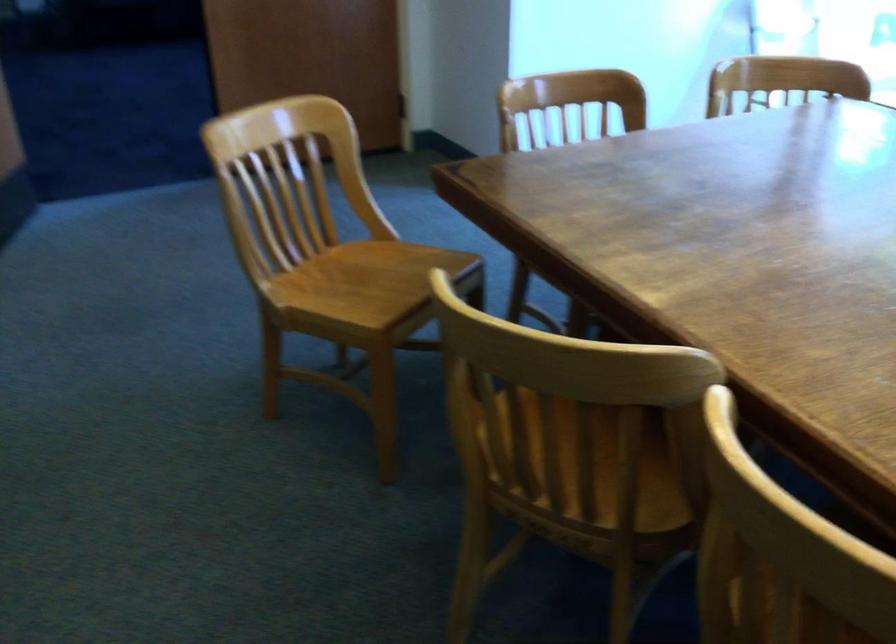
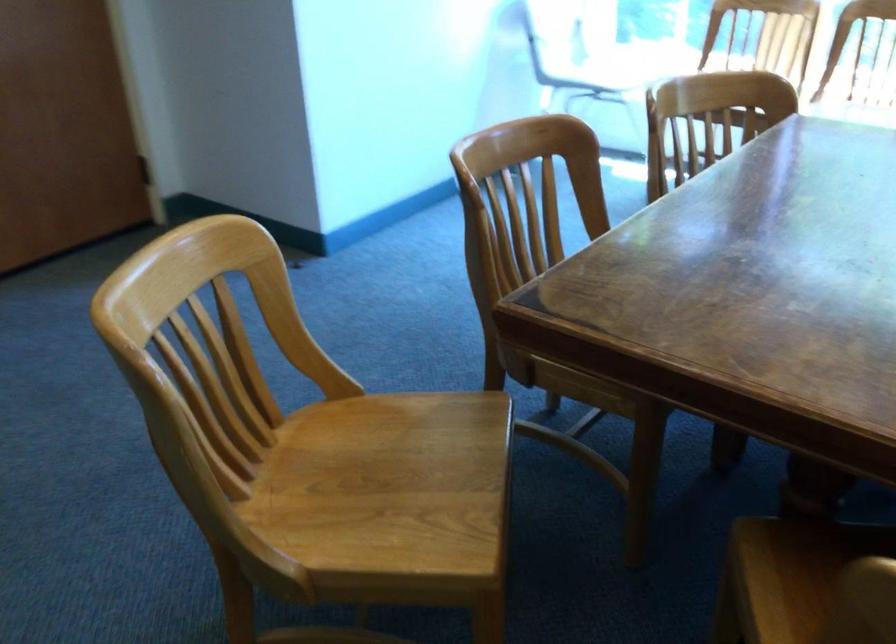
Which direction would the cameraman need to move to produce the second image?

The cameraman moved toward left, forward.